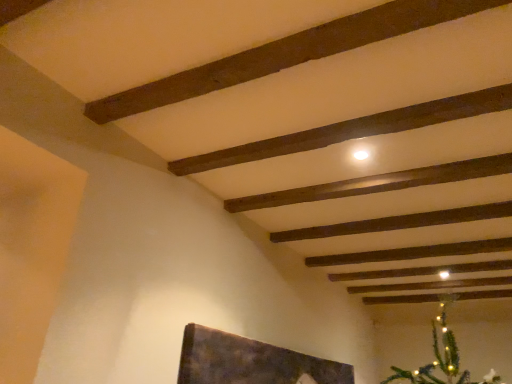
Question: From the image's perspective, is smooth wooden plank at center, arranged as the first plank when ordered from the bottom, located above or below dark brown wood plank at upper center, which ranks as the first plank in top-to-bottom order?

Choices:
 (A) above
 (B) below

Answer: (B)

Question: Is smooth wooden plank at center, marked as the third plank in a top-to-bottom arrangement, to the left or to the right of dark brown wood plank at upper center, placed as the third plank when sorted from bottom to top, in the image?

Choices:
 (A) right
 (B) left

Answer: (A)

Question: Which object is the farthest from the dark brown wood plank at upper center, which ranks as the first plank in top-to-bottom order?

Choices:
 (A) dark brown wood plank at upper center, placed as the second plank when sorted from bottom to top
 (B) smooth wooden plank at center, marked as the third plank in a top-to-bottom arrangement

Answer: (B)

Question: Estimate the real-world distances between objects in this image. Which object is closer to the dark brown wood plank at upper center, which ranks as the first plank in top-to-bottom order?

Choices:
 (A) smooth wooden plank at center, marked as the third plank in a top-to-bottom arrangement
 (B) dark brown wood plank at upper center, placed as the second plank when sorted from bottom to top

Answer: (B)